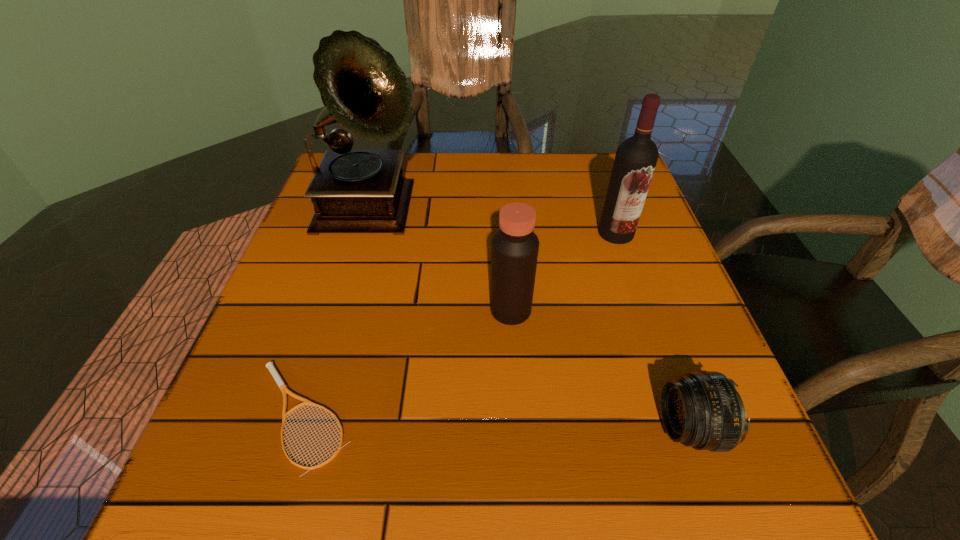
Identify the location of free spot between the fourth tallest object and the wine bottle. (653, 331).

Identify the location of unoccupied area between the shortest object and the third object from left to right. (407, 363).

The width and height of the screenshot is (960, 540). What are the coordinates of `vacant region between the wine bottle and the third object from left to right` in the screenshot? It's located at (564, 272).

At what (x,y) coordinates should I click in order to perform the action: click on vacant space that's between the third nearest object and the second tallest object. Please return your answer as a coordinate pair (x, y). This screenshot has height=540, width=960. Looking at the image, I should click on (564, 272).

The width and height of the screenshot is (960, 540). I want to click on free space between the third farthest object and the telephoto lens, so click(x=600, y=369).

You are a GUI agent. You are given a task and a screenshot of the screen. Output one action in this format:
    pyautogui.click(x=<x>, y=<y>)
    Task: Click on the free space between the wine bottle and the third farthest object
    Image resolution: width=960 pixels, height=540 pixels.
    Given the screenshot: What is the action you would take?
    pyautogui.click(x=564, y=272)

Where is `free point between the wine bottle and the vinegar`? The image size is (960, 540). free point between the wine bottle and the vinegar is located at coordinates (564, 272).

Where is `unoccupied position between the shortest object and the telephoto lens`? The width and height of the screenshot is (960, 540). unoccupied position between the shortest object and the telephoto lens is located at coordinates (496, 422).

Identify the location of free space that is in between the tennis racket and the record player. This screenshot has height=540, width=960. (337, 314).

Identify which object is the second closest to the tennis racket. Please provide its 2D coordinates. Your answer should be formatted as a tuple, i.e. [(x, y)], where the tuple contains the x and y coordinates of a point satisfying the conditions above.

[(363, 89)]